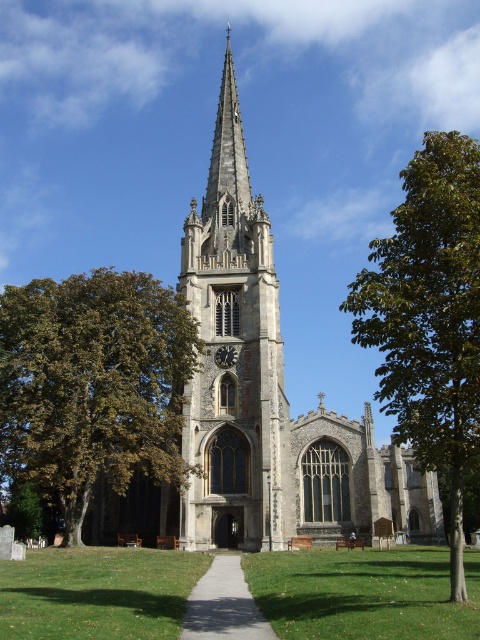
You are standing at the entrance of the church and want to take a photo of the stone church steeple at center. Since you are on the gravel pathway at center, will the steeple be visible in your photo if you point your camera straight ahead?

The stone church steeple at center is above the gravel pathway at center, so pointing the camera straight ahead from the gravel pathway at center should capture the steeple in the photo as it is positioned above.

You are planning to install a new bench between the green leafy tree at center and the green leafy tree at right. The bench you have is 10 feet long. Will there be enough space between the two trees to place the bench?

The distance between the green leafy tree at center and the green leafy tree at right is 84.50 feet. Since the bench is only 10 feet long, there is more than enough space to place it between them.

You are planning to take a photo of the smooth stone tower at center and the gravel pathway at center from a distance. Which object will appear larger in the photo?

The smooth stone tower at center is taller than gravel pathway at center, so it will appear larger in the photo.